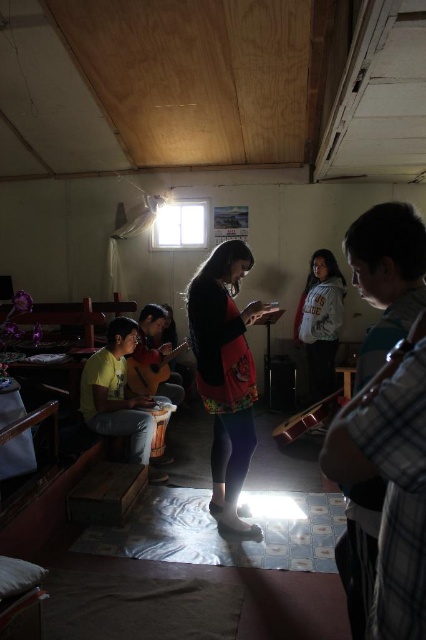
Question: Can you confirm if matte black sweater at center is smaller than yellow matte shirt at left?

Choices:
 (A) yes
 (B) no

Answer: (A)

Question: Among these objects, which one is nearest to the camera?

Choices:
 (A) matte black sweater at center
 (B) yellow matte shirt at left

Answer: (A)

Question: In this image, where is matte black sweater at center located relative to yellow matte shirt at left?

Choices:
 (A) left
 (B) right

Answer: (B)

Question: Can you confirm if matte black sweater at center is positioned below yellow matte shirt at left?

Choices:
 (A) yes
 (B) no

Answer: (B)

Question: Which of the following is the closest to the observer?

Choices:
 (A) (218, 289)
 (B) (111, 332)

Answer: (A)